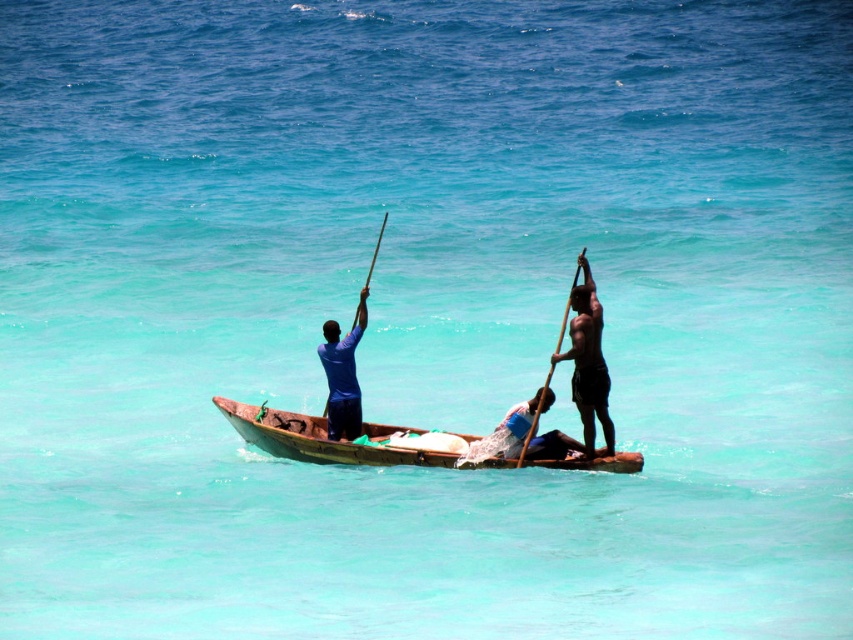
You are standing on the deck of the boat and need to retrieve both the shiny black pole at right and the wooden pole at right. What is the minimum distance you must walk to collect both poles?

The shiny black pole at right and wooden pole at right are 3.10 meters apart from each other. To collect both poles, you must walk at least 3.10 meters.

You are standing on a dock 50 meters away from the wooden canoe at center. You want to throw a lifebuoy to someone in the canoe. Is the distance within your throwing range?

The wooden canoe at center is 47.18 meters away from the viewer, so yes, the distance is within your throwing range since it is less than 50 meters.